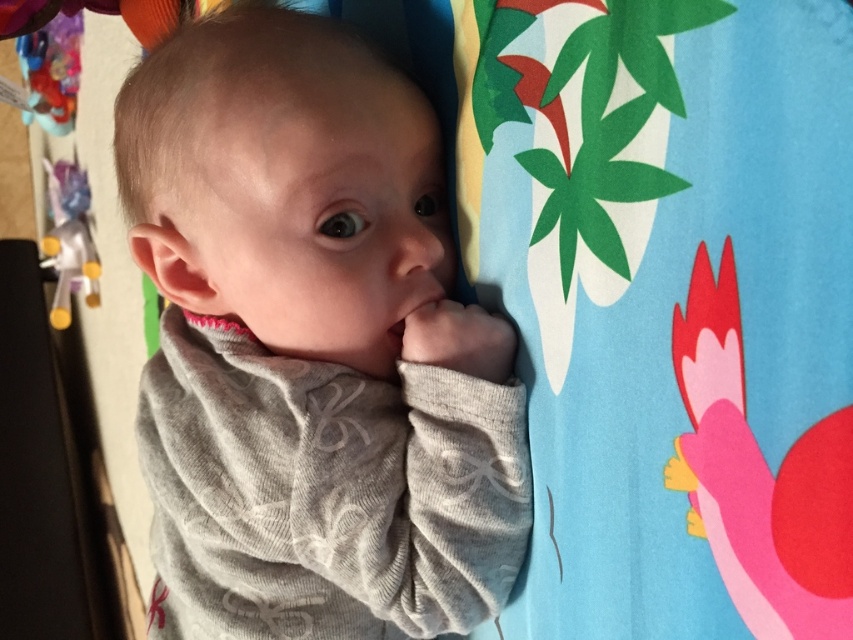
Question: Can you confirm if gray soft fabric baby at center is positioned above yellow plastic toy at left?

Choices:
 (A) no
 (B) yes

Answer: (A)

Question: Is the position of yellow plastic toy at left more distant than that of plastic toy at upper left?

Choices:
 (A) yes
 (B) no

Answer: (B)

Question: Which is farther from the gray soft fabric baby at center?

Choices:
 (A) plastic toy at upper left
 (B) yellow plastic toy at left

Answer: (A)

Question: Which point is farther to the camera?

Choices:
 (A) yellow plastic toy at left
 (B) plastic toy at upper left

Answer: (B)

Question: Which point is closer to the camera?

Choices:
 (A) (x=62, y=35)
 (B) (x=44, y=243)

Answer: (A)

Question: Can you confirm if yellow plastic toy at left is smaller than plastic toy at upper left?

Choices:
 (A) no
 (B) yes

Answer: (A)